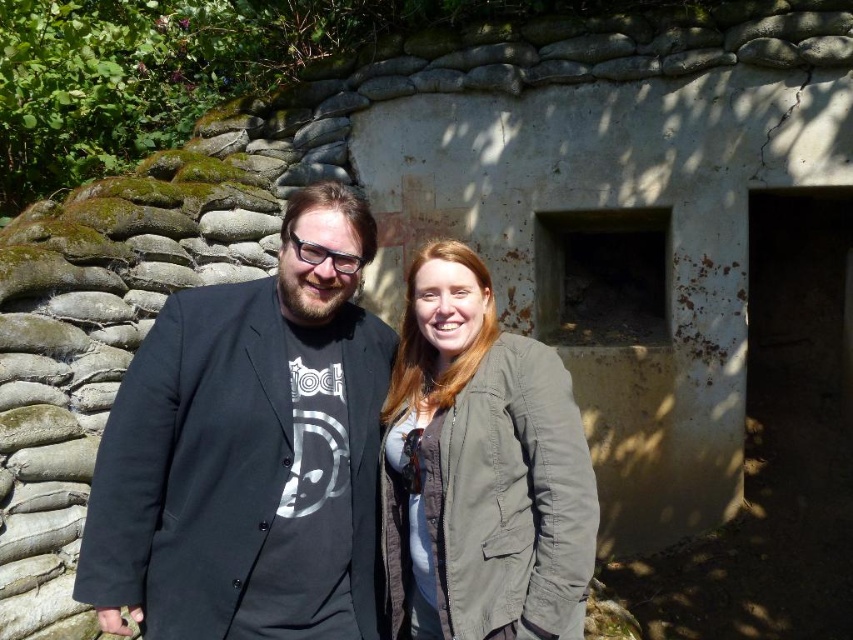
Question: Can you confirm if black matte jacket at center is positioned to the left of green matte jacket at center?

Choices:
 (A) yes
 (B) no

Answer: (A)

Question: Which of the following is the closest to the observer?

Choices:
 (A) [175, 326]
 (B) [585, 492]

Answer: (B)

Question: Where is black matte jacket at center located in relation to green matte jacket at center in the image?

Choices:
 (A) below
 (B) above

Answer: (B)

Question: Can you confirm if black matte jacket at center is positioned to the right of green matte jacket at center?

Choices:
 (A) no
 (B) yes

Answer: (A)

Question: Among these points, which one is nearest to the camera?

Choices:
 (A) (80, 554)
 (B) (393, 438)

Answer: (A)